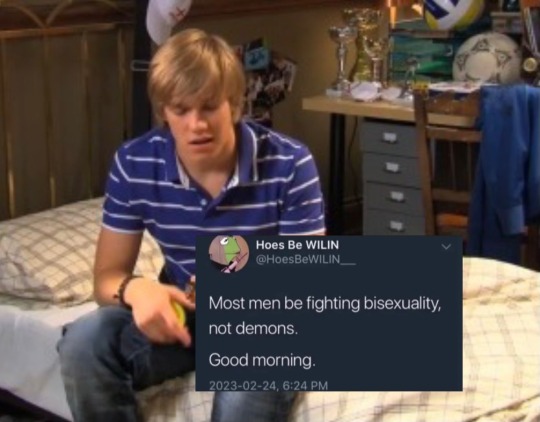
Locate an element on the screen. bed sheets is located at coordinates (37, 321), (40, 369).